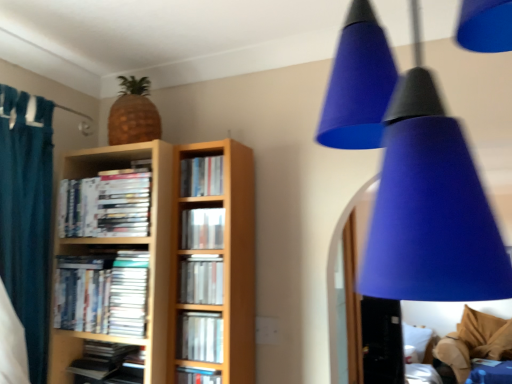
Question: Can you confirm if white soft pillow at lower right is bigger than matte black book at lower left, placed as the seventh book when sorted from top to bottom?

Choices:
 (A) yes
 (B) no

Answer: (A)

Question: Is white soft pillow at lower right wider than matte black book at lower left, placed as the seventh book when sorted from top to bottom?

Choices:
 (A) yes
 (B) no

Answer: (A)

Question: Is the position of white soft pillow at lower right less distant than that of matte black book at lower left, the second book in the bottom-to-top sequence?

Choices:
 (A) yes
 (B) no

Answer: (B)

Question: Considering the relative positions of white soft pillow at lower right and matte black book at lower left, the second book in the bottom-to-top sequence, in the image provided, is white soft pillow at lower right to the right of matte black book at lower left, the second book in the bottom-to-top sequence, from the viewer's perspective?

Choices:
 (A) no
 (B) yes

Answer: (B)

Question: Could matte black book at lower left, the second book in the bottom-to-top sequence, be considered to be inside white soft pillow at lower right?

Choices:
 (A) no
 (B) yes

Answer: (A)

Question: Can you confirm if white soft pillow at lower right is thinner than matte black book at lower left, placed as the seventh book when sorted from top to bottom?

Choices:
 (A) no
 (B) yes

Answer: (A)

Question: Can you confirm if blue matte cone at upper right is positioned to the left of white soft pillow at lower right?

Choices:
 (A) no
 (B) yes

Answer: (B)

Question: Can you confirm if blue matte cone at upper right is positioned to the right of white soft pillow at lower right?

Choices:
 (A) yes
 (B) no

Answer: (B)

Question: From the image's perspective, is blue matte cone at upper right beneath white soft pillow at lower right?

Choices:
 (A) yes
 (B) no

Answer: (B)

Question: Is blue matte cone at upper right shorter than white soft pillow at lower right?

Choices:
 (A) yes
 (B) no

Answer: (A)

Question: Does blue matte cone at upper right have a larger size compared to white soft pillow at lower right?

Choices:
 (A) yes
 (B) no

Answer: (A)

Question: Could you tell me if blue matte cone at upper right is turned towards white soft pillow at lower right?

Choices:
 (A) no
 (B) yes

Answer: (B)

Question: Is matte silver book at center, positioned as the third book in bottom-to-top order, outside of matte silver book at center, which ranks as the 5th book in bottom-to-top order?

Choices:
 (A) yes
 (B) no

Answer: (A)